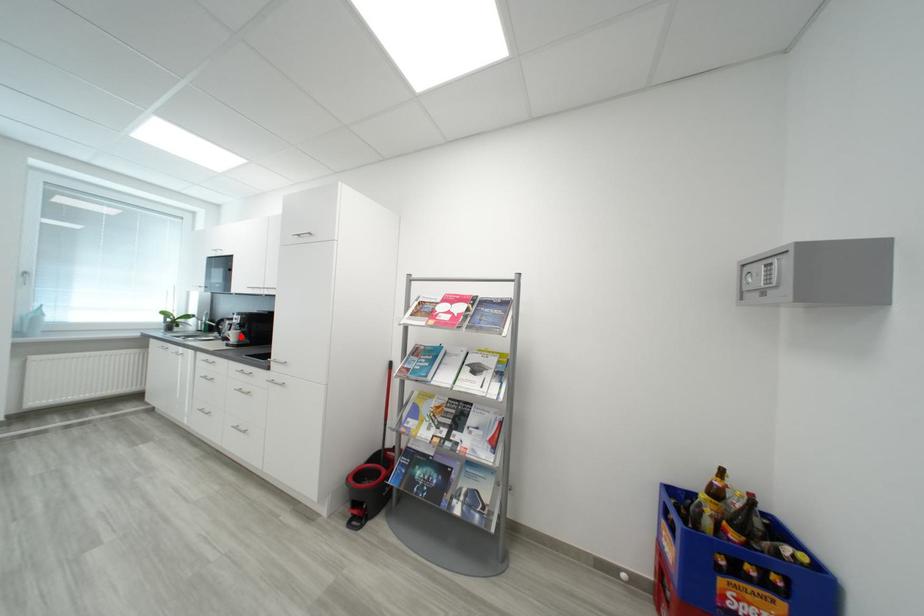
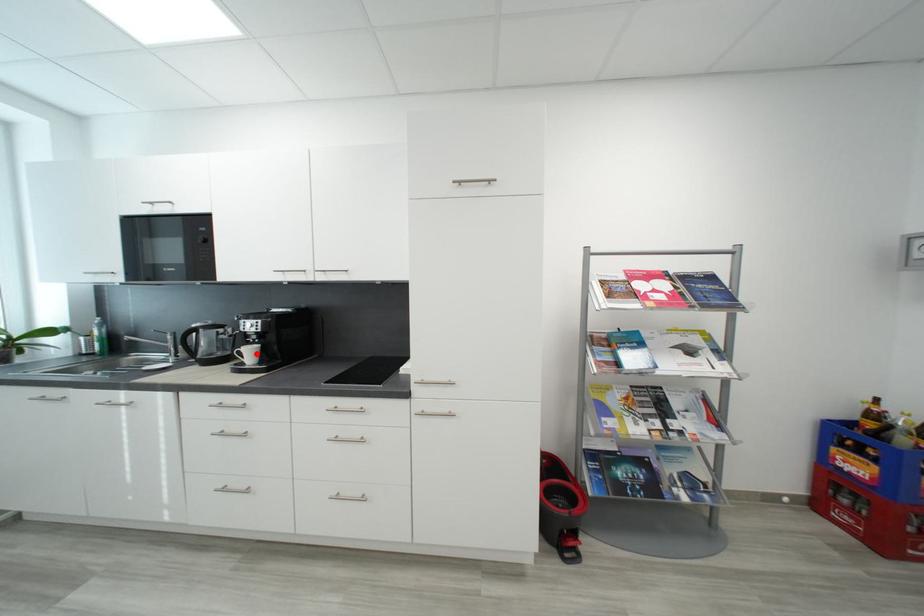
I am providing you with two images of the same scene from different viewpoints. A red point is marked on the first image and another point is marked on the second image. Is the marked point in image1 the same physical position as the marked point in image2?

Yes